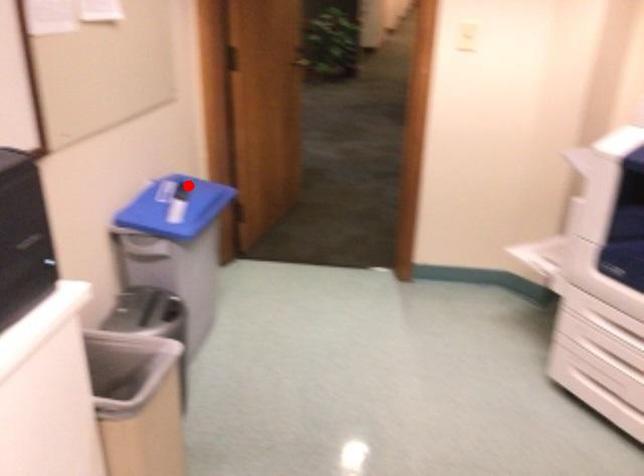
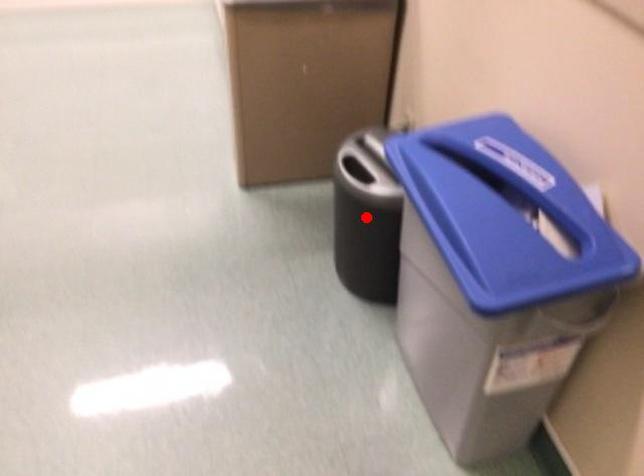
I am providing you with two images of the same scene from different viewpoints. A red point is marked on the first image and another point is marked on the second image. Does the point marked in image1 correspond to the same location as the one in image2?

No